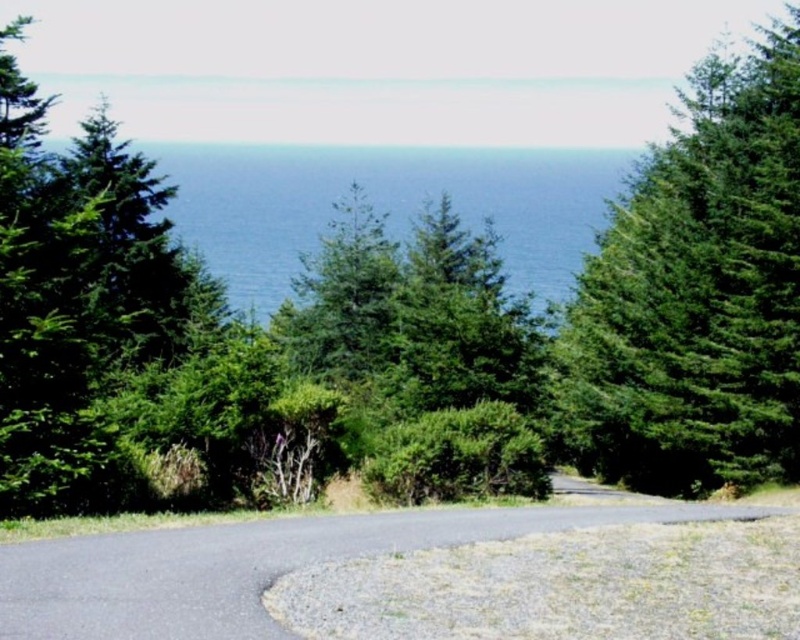
Which is behind, point (704, 81) or point (562, 198)?

The point (562, 198) is more distant.

Locate an element on the screen. The image size is (800, 640). green textured tree at upper right is located at coordinates (698, 292).

Who is more distant from viewer, (704, 352) or (410, 163)?

The point (410, 163) is behind.

Find the location of a particular element. Image resolution: width=800 pixels, height=640 pixels. green textured tree at upper right is located at coordinates (698, 292).